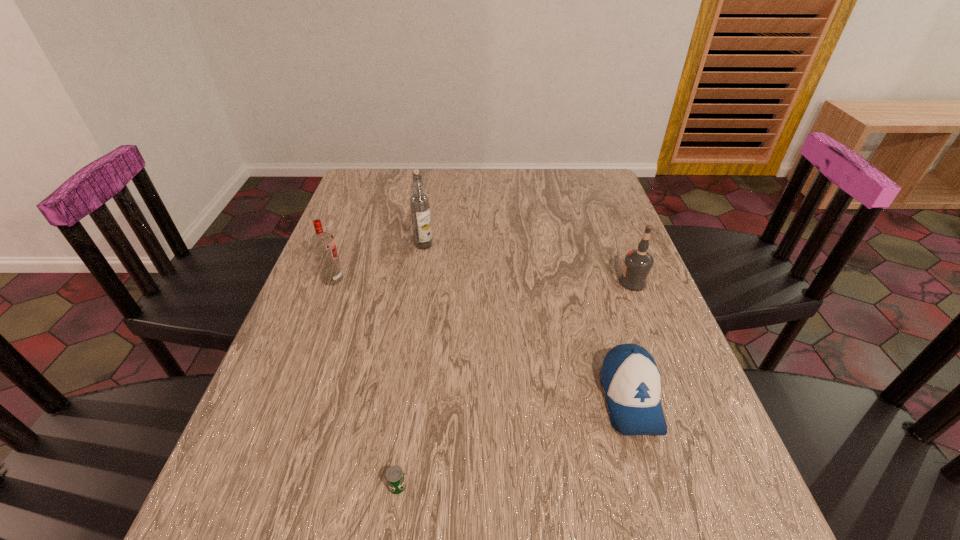
The width and height of the screenshot is (960, 540). Identify the location of vacant region between the farthest vodka and the baseball cap. pos(527,322).

Where is `free space between the farthest vodka and the fourth farthest object`? Image resolution: width=960 pixels, height=540 pixels. free space between the farthest vodka and the fourth farthest object is located at coordinates (527, 322).

Identify the location of vacant point located between the nearest object and the fourth object from left to right. (515, 442).

Find the location of a particular element. This screenshot has height=540, width=960. vacant area between the baseball cap and the leftmost vodka is located at coordinates pyautogui.click(x=482, y=339).

The height and width of the screenshot is (540, 960). Find the location of `vacant space that is in between the tallest vodka and the beer can`. vacant space that is in between the tallest vodka and the beer can is located at coordinates (411, 366).

Identify the location of unoccupied area between the rightmost object and the shortest object. The width and height of the screenshot is (960, 540). (516, 384).

Locate which object ranks second in proximity to the shortest object. Please provide its 2D coordinates. Your answer should be formatted as a tuple, i.e. [(x, y)], where the tuple contains the x and y coordinates of a point satisfying the conditions above.

[(323, 245)]

The height and width of the screenshot is (540, 960). I want to click on object that is the second closest to the baseball cap, so click(x=395, y=478).

The width and height of the screenshot is (960, 540). In order to click on vodka that stands as the closest to the leftmost vodka in this screenshot , I will do `click(419, 203)`.

I want to click on vodka that is the second closest to the leftmost vodka, so click(638, 263).